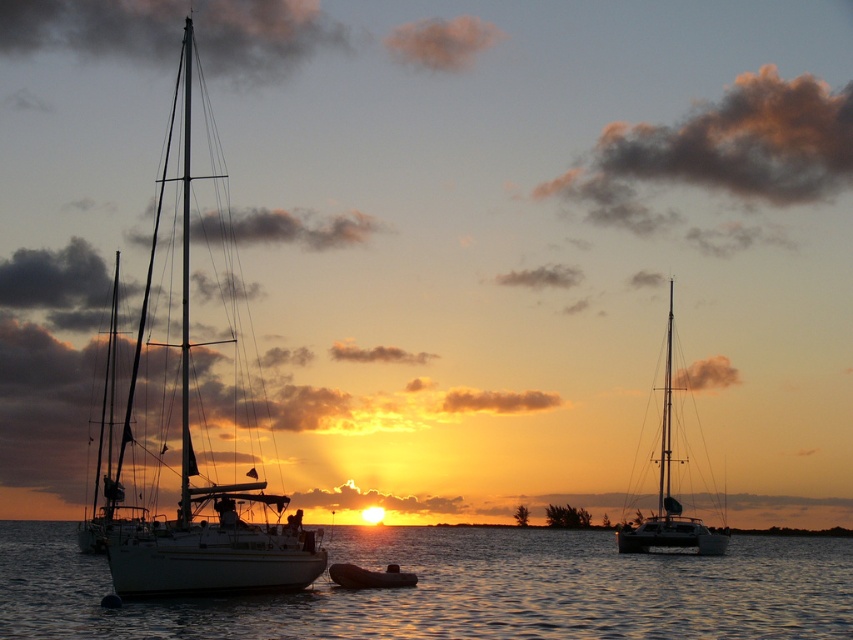
Who is positioned more to the right, silvery metallic sailboat at center or rubber dinghy at center?

Positioned to the right is silvery metallic sailboat at center.

Image resolution: width=853 pixels, height=640 pixels. Describe the element at coordinates (669, 492) in the screenshot. I see `silvery metallic sailboat at center` at that location.

The height and width of the screenshot is (640, 853). I want to click on silvery metallic sailboat at center, so click(x=669, y=492).

Which is more to the left, glistening water at center or silvery metallic sailboat at center?

Positioned to the left is glistening water at center.

Can you confirm if glistening water at center is smaller than silvery metallic sailboat at center?

Actually, glistening water at center might be larger than silvery metallic sailboat at center.

Is point (444, 529) positioned before point (711, 540)?

No, (444, 529) is further to viewer.

Identify the location of glistening water at center. This screenshot has height=640, width=853. (456, 589).

Does white matte sailboat at left appear on the left side of rubber dinghy at center?

Indeed, white matte sailboat at left is positioned on the left side of rubber dinghy at center.

Who is more forward, [219,531] or [347,573]?

Point [219,531] is in front.

Is point (152, 241) positioned behind point (360, 577)?

Yes, it is.

This screenshot has width=853, height=640. What are the coordinates of `white matte sailboat at left` in the screenshot? It's located at (196, 474).